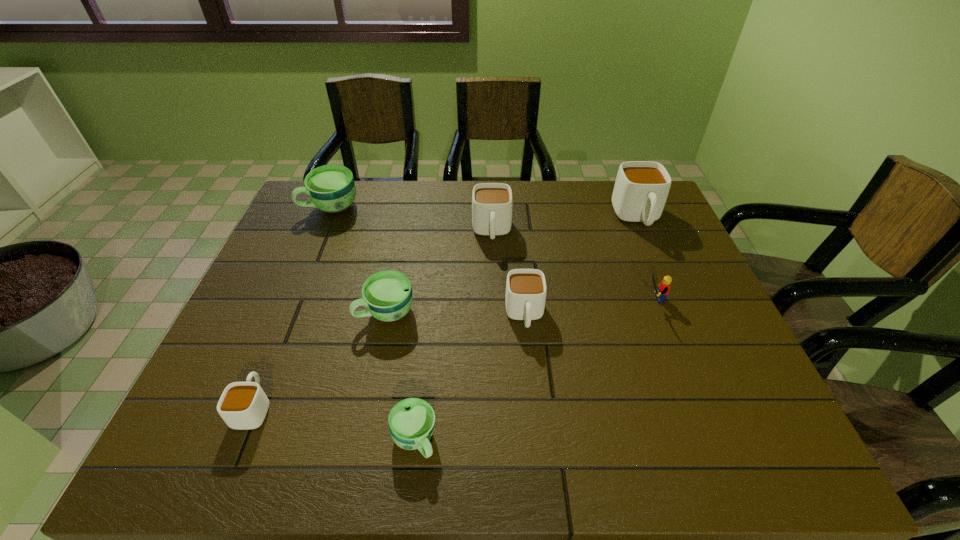
Locate an element on the screen. This screenshot has width=960, height=540. the smallest blue cup is located at coordinates (411, 421).

Locate an element on the screen. vacant point located on the side with the handle of the tallest object is located at coordinates (662, 278).

Find the location of a particular element. This screenshot has height=540, width=960. vacant space located on the side with the handle of the second biggest white cup is located at coordinates [493, 275].

The height and width of the screenshot is (540, 960). In order to click on vacant space located on the front of the leftmost blue cup in this screenshot , I will do `click(286, 314)`.

The width and height of the screenshot is (960, 540). I want to click on blank space located 0.130m on the front-facing side of the yellow Lego, so click(589, 299).

Identify the location of vacant point located on the front-facing side of the yellow Lego. This screenshot has width=960, height=540. (535, 299).

The width and height of the screenshot is (960, 540). I want to click on free space located 0.400m on the front-facing side of the yellow Lego, so click(x=485, y=299).

Locate an element on the screen. blank space located on the side with the handle of the third biggest white cup is located at coordinates pyautogui.click(x=534, y=411).

Where is `vacant space located 0.140m on the front of the second biggest blue cup`? This screenshot has height=540, width=960. vacant space located 0.140m on the front of the second biggest blue cup is located at coordinates (372, 380).

What are the coordinates of `free spot located 0.150m on the side with the handle of the smallest white cup` in the screenshot? It's located at (x=285, y=331).